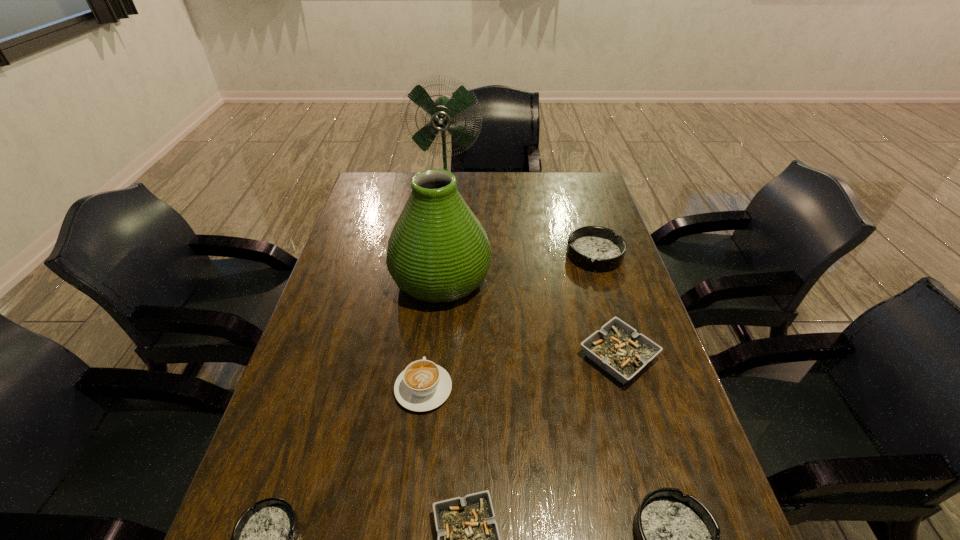
The height and width of the screenshot is (540, 960). I want to click on vacant space located 0.160m on the back of the vase, so [446, 219].

Find the location of a particular element. The height and width of the screenshot is (540, 960). free space located 0.340m on the side of the white cappuccino with the handle is located at coordinates (436, 274).

In order to click on vacant space located 0.070m on the side of the white cappuccino with the handle in this screenshot , I will do `click(428, 343)`.

Where is `free space located on the side of the white cappuccino with the handle`? This screenshot has width=960, height=540. free space located on the side of the white cappuccino with the handle is located at coordinates (435, 291).

The height and width of the screenshot is (540, 960). Find the location of `vacant space located 0.230m on the back of the biggest dark ashtray`. vacant space located 0.230m on the back of the biggest dark ashtray is located at coordinates (578, 201).

The height and width of the screenshot is (540, 960). Identify the location of vacant space located on the front of the second farthest ashtray. (646, 453).

The height and width of the screenshot is (540, 960). Find the location of `object that is positioned at the far edge`. object that is positioned at the far edge is located at coordinates (442, 111).

This screenshot has height=540, width=960. I want to click on free space at the far edge, so click(485, 174).

Where is `free space at the left edge of the desktop`? The height and width of the screenshot is (540, 960). free space at the left edge of the desktop is located at coordinates (360, 295).

Locate an element on the screen. The height and width of the screenshot is (540, 960). free region at the right edge of the desktop is located at coordinates (570, 222).